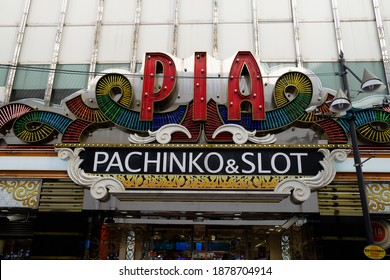
You are a GUI agent. You are given a task and a screenshot of the screen. Output one action in this format:
    pyautogui.click(x=<x>, y=<y>)
    Task: Click on the white wall
    The image size is (390, 280).
    Given the screenshot: What is the action you would take?
    pyautogui.click(x=194, y=20)